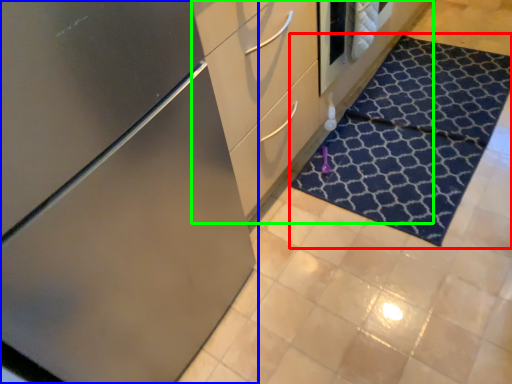
Question: Which is nearer to the doormat (highlighted by a red box)? cabinetry (highlighted by a blue box) or dresser (highlighted by a green box).

Choices:
 (A) cabinetry
 (B) dresser

Answer: (B)